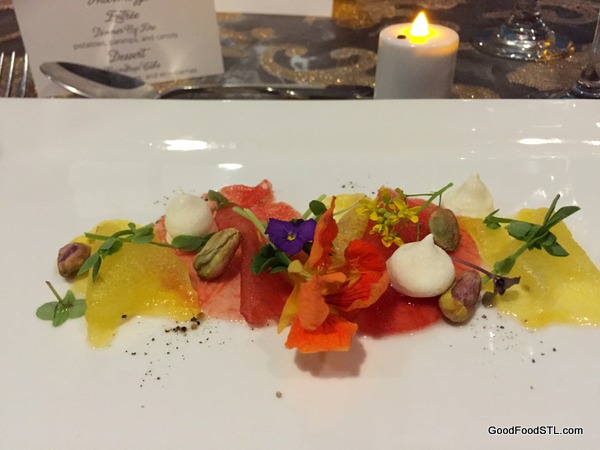
You are a GUI agent. You are given a task and a screenshot of the screen. Output one action in this format:
    pyautogui.click(x=<x>, y=<y>)
    Task: Click on the spoon
    
    Given the screenshot: What is the action you would take?
    (x=141, y=87)